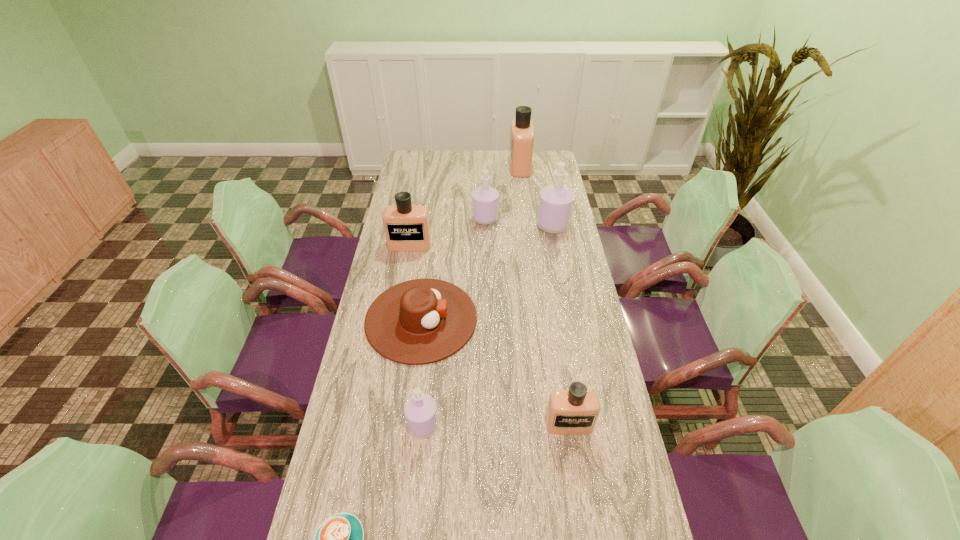
I want to click on perfume that is the fourth closest to the second nearest beige perfume, so click(x=420, y=410).

Identify which perfume is located as the fourth nearest to the smallest purple perfume. Please provide its 2D coordinates. Your answer should be formatted as a tuple, i.e. [(x, y)], where the tuple contains the x and y coordinates of a point satisfying the conditions above.

[(556, 202)]

Select which beige perfume is the second closest to the farthest perfume. Please provide its 2D coordinates. Your answer should be formatted as a tuple, i.e. [(x, y)], where the tuple contains the x and y coordinates of a point satisfying the conditions above.

[(575, 411)]

Locate which beige perfume ranks in proximity to the third perfume from left to right. Please provide its 2D coordinates. Your answer should be formatted as a tuple, i.e. [(x, y)], where the tuple contains the x and y coordinates of a point satisfying the conditions above.

[(406, 226)]

Locate an element on the screen. purple perfume that is the second nearest to the rightmost purple perfume is located at coordinates (420, 410).

Select which purple perfume is the closest to the smallest purple perfume. Please provide its 2D coordinates. Your answer should be formatted as a tuple, i.e. [(x, y)], where the tuple contains the x and y coordinates of a point satisfying the conditions above.

[(485, 200)]

This screenshot has height=540, width=960. I want to click on vacant region that satisfies the following two spatial constraints: 1. on the front label of the fourth farthest perfume; 2. on the right side of the smallest purple perfume, so click(377, 426).

Find the location of a particular element. vacant area in the image that satisfies the following two spatial constraints: 1. on the back side of the fourth perfume from right to left; 2. on the right side of the leftmost purple perfume is located at coordinates (444, 219).

I want to click on vacant area in the image that satisfies the following two spatial constraints: 1. on the front label of the fifth nearest object; 2. on the left side of the nearest purple perfume, so click(377, 426).